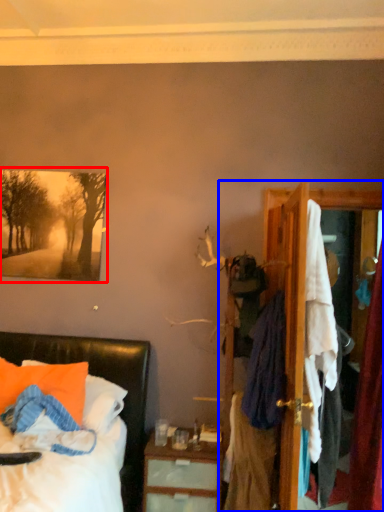
Question: Which of the following is the farthest to the observer, picture frame (highlighted by a red box) or dresser (highlighted by a blue box)?

Choices:
 (A) picture frame
 (B) dresser

Answer: (A)